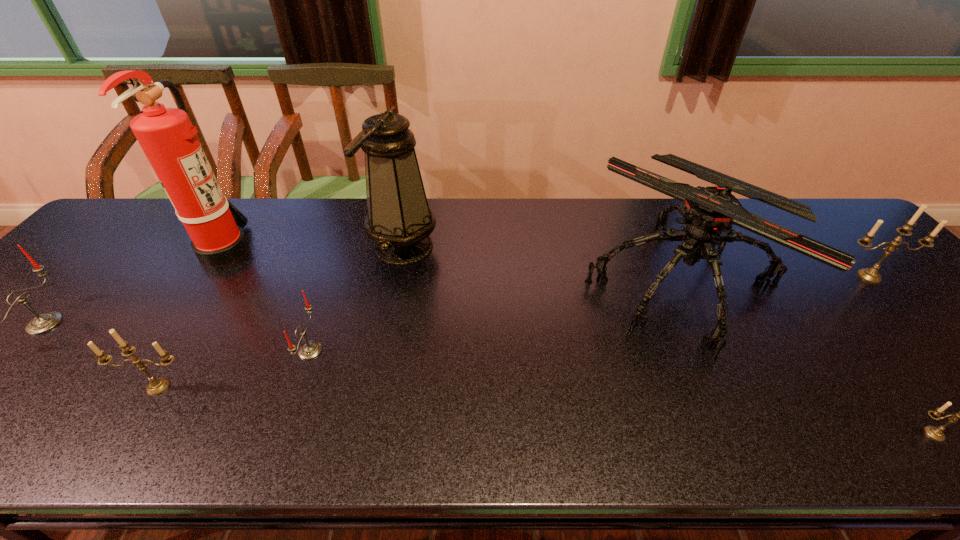
This screenshot has width=960, height=540. Find the location of `red fire extinguisher`. red fire extinguisher is located at coordinates (166, 135).

At what (x,y) coordinates should I click in order to perform the action: click on the tallest object. Please return your answer as a coordinate pair (x, y). This screenshot has height=540, width=960. Looking at the image, I should click on (166, 135).

Image resolution: width=960 pixels, height=540 pixels. I want to click on the seventh shortest object, so click(399, 220).

What are the coordinates of `the fifth object from left to right` in the screenshot? It's located at (399, 220).

Locate an element on the screen. This screenshot has width=960, height=540. the sixth object from left to right is located at coordinates (710, 213).

At what (x,y) coordinates should I click in order to perform the action: click on the third tallest object. Please return your answer as a coordinate pair (x, y). The image size is (960, 540). Looking at the image, I should click on (710, 213).

Where is `the farthest metallic candle`? Image resolution: width=960 pixels, height=540 pixels. the farthest metallic candle is located at coordinates (871, 275).

Locate an element on the screen. Image resolution: width=960 pixels, height=540 pixels. the rightmost metallic candle is located at coordinates (871, 275).

Identify the location of the left red candle. This screenshot has width=960, height=540. (45, 322).

At what (x,y) coordinates should I click in order to perform the action: click on the bigger red candle. Please return your answer as a coordinate pair (x, y). This screenshot has width=960, height=540. Looking at the image, I should click on (45, 322).